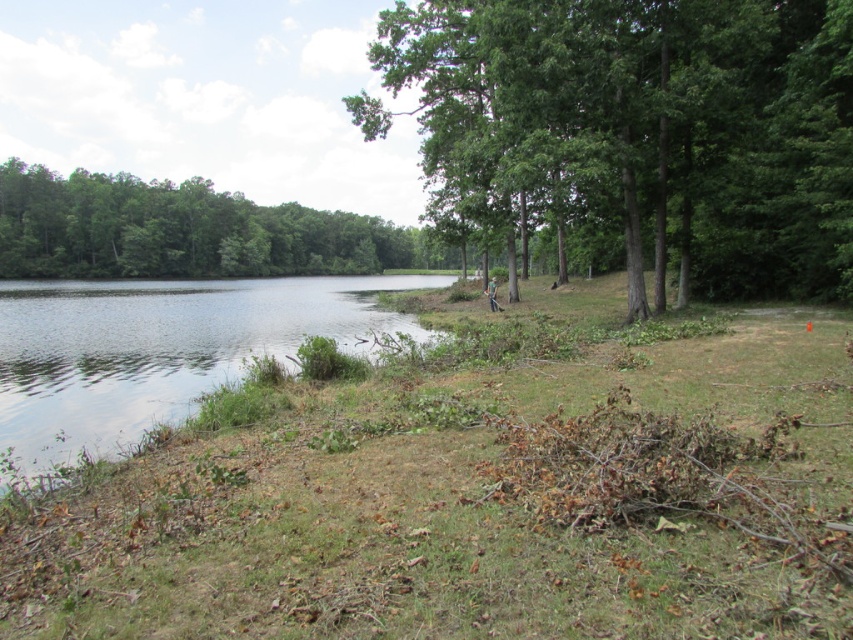
Question: Which of the following is the closest to the observer?

Choices:
 (A) green leafy tree at left
 (B) clear water at lake left

Answer: (B)

Question: From the image, what is the correct spatial relationship of clear water at lake left in relation to green leafy tree at left?

Choices:
 (A) left
 (B) right

Answer: (B)

Question: Which of the following is the closest to the observer?

Choices:
 (A) green leafy tree at left
 (B) green leafy tree at center

Answer: (B)

Question: Does green leafy tree at center appear over green leafy tree at left?

Choices:
 (A) no
 (B) yes

Answer: (B)

Question: Where is green leafy tree at center located in relation to clear water at lake left in the image?

Choices:
 (A) below
 (B) above

Answer: (B)

Question: Estimate the real-world distances between objects in this image. Which object is farther from the clear water at lake left?

Choices:
 (A) green leafy tree at center
 (B) green leafy tree at left

Answer: (B)